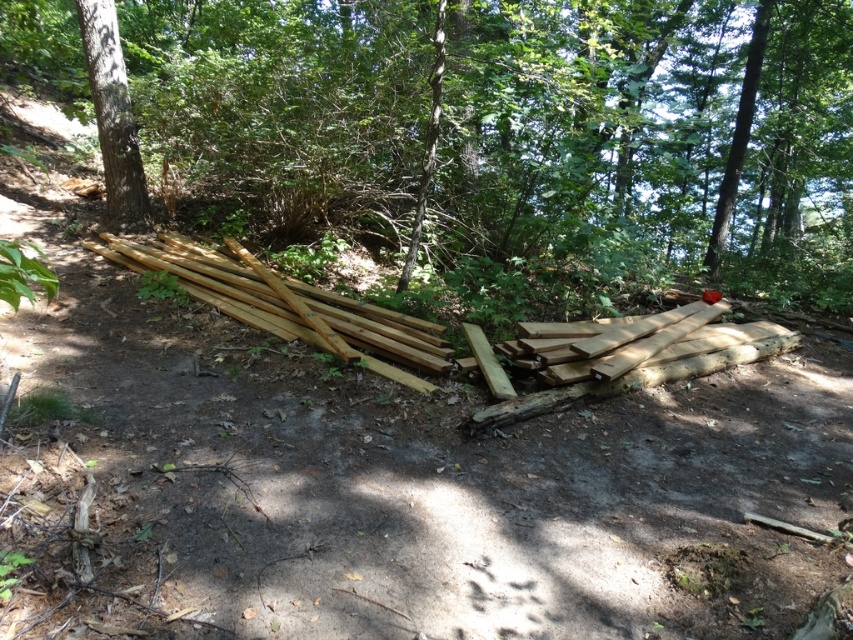
Which is more to the right, smooth brown wood at center or natural wood at left?

From the viewer's perspective, smooth brown wood at center appears more on the right side.

Measure the distance from smooth brown wood at center to natural wood at left.

They are 92.37 centimeters apart.

Who is more forward, (88, 93) or (224, 291)?

Point (224, 291)

Where is `smooth brown wood at center`? This screenshot has width=853, height=640. smooth brown wood at center is located at coordinates (520, 124).

Between natural wood at left and natural wood at center, which one appears on the right side from the viewer's perspective?

natural wood at center is more to the right.

Can you confirm if natural wood at left is shorter than natural wood at center?

Incorrect, natural wood at left's height does not fall short of natural wood at center's.

Who is more distant from viewer, (198, 294) or (699, 365)?

The point (198, 294) is behind.

You are a GUI agent. You are given a task and a screenshot of the screen. Output one action in this format:
    pyautogui.click(x=<x>, y=<y>)
    Task: Click on the natural wood at left
    
    Given the screenshot: What is the action you would take?
    pyautogui.click(x=285, y=305)

Is smooth brown wood at center above natural wood at center?

Correct, smooth brown wood at center is located above natural wood at center.

Looking at this image, which is below, smooth brown wood at center or natural wood at center?

natural wood at center

Identify the location of smooth brown wood at center. Image resolution: width=853 pixels, height=640 pixels. (520, 124).